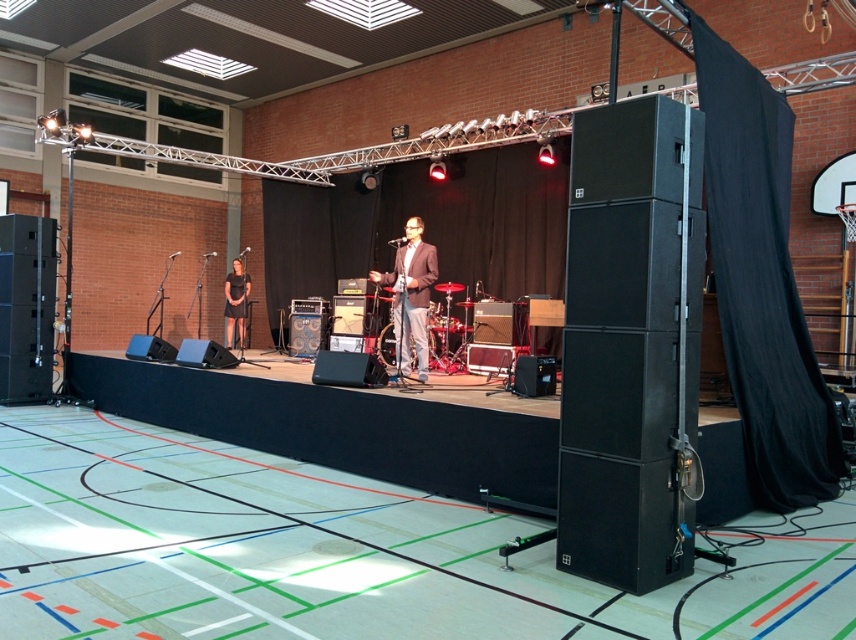
Question: Does matte black suit at center appear over dark gray dress at stage left?

Choices:
 (A) yes
 (B) no

Answer: (A)

Question: Which point is closer to the camera?

Choices:
 (A) matte black suit at center
 (B) dark gray dress at stage left

Answer: (A)

Question: Which point is farther to the camera?

Choices:
 (A) matte black suit at center
 (B) dark gray dress at stage left

Answer: (B)

Question: Is matte black suit at center above dark gray dress at stage left?

Choices:
 (A) yes
 (B) no

Answer: (A)

Question: Can you confirm if matte black suit at center is bigger than dark gray dress at stage left?

Choices:
 (A) no
 (B) yes

Answer: (A)